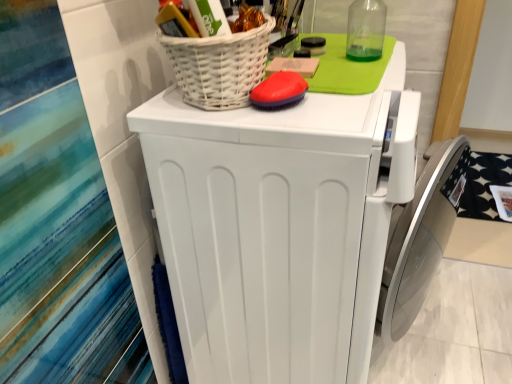
At what (x,y) coordinates should I click in order to perform the action: click on vacant space positioned to the left of red rubber brush at upper center. Please return your answer as a coordinate pair (x, y). The height and width of the screenshot is (384, 512). Looking at the image, I should click on (195, 109).